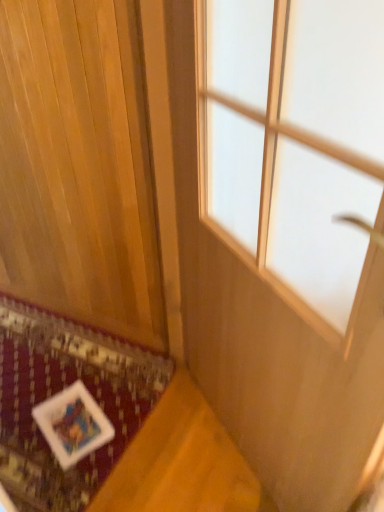
The height and width of the screenshot is (512, 384). I want to click on vacant space situated above white fabric mat at lower left (from a real-world perspective), so click(73, 401).